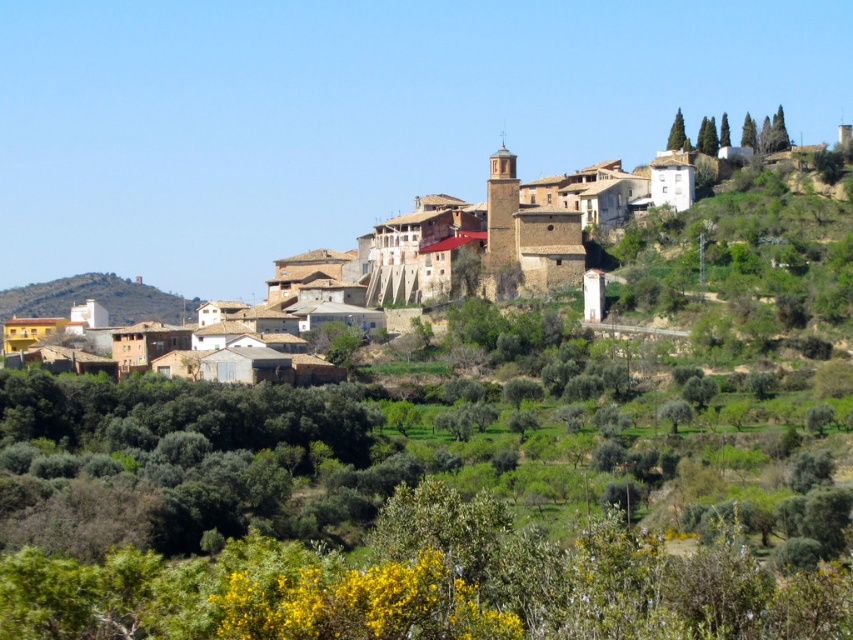
You are a tourist standing in the middle of the hillside town and want to take a photo that includes both the brown stone buildings at center and the brown textured hillside at left. Which object should you focus on to ensure both are in the frame without moving your position?

Since the brown stone buildings at center are larger in size compared to the brown textured hillside at left, you should focus on the brown stone buildings at center to ensure both are in the frame without moving your position.

You are a tourist standing in front of the brown textured hillside at left and want to take a photo of the brown stone buildings at center. Which direction should you move to frame them properly?

The brown stone buildings at center are to the right of the brown textured hillside at left, so you should move to the right to frame them properly.

You are an architect planning to build a new garden between the brown stone buildings at center and the brown textured hillside at left. Based on the scene, which area has more space available for the garden?

The brown stone buildings at center have a larger width than the brown textured hillside at left, so there is more space available for the garden near the brown stone buildings at center.